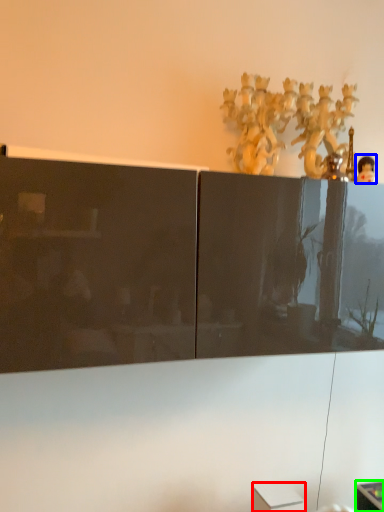
Question: Which object is the closest to the cabinetry (highlighted by a red box)? Choose among these: toy (highlighted by a blue box) or furniture (highlighted by a green box).

Choices:
 (A) toy
 (B) furniture

Answer: (B)